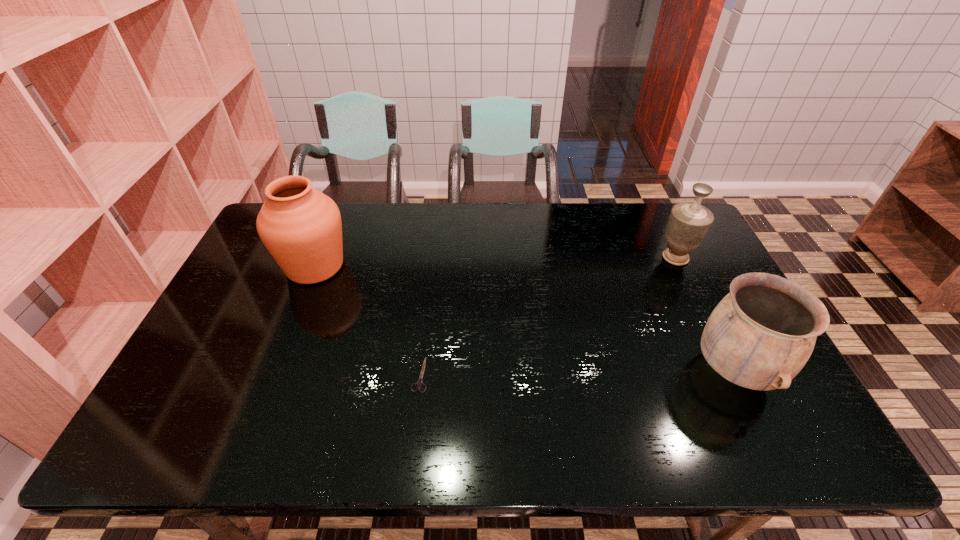
Locate an element on the screen. vacant area at the far edge is located at coordinates (626, 224).

In the image, there is a desktop. Where is `vacant space at the near edge`? This screenshot has height=540, width=960. vacant space at the near edge is located at coordinates (523, 421).

Locate an element on the screen. The height and width of the screenshot is (540, 960). free space at the left edge of the desktop is located at coordinates (235, 286).

The image size is (960, 540). I want to click on vacant space at the right edge of the desktop, so click(693, 290).

This screenshot has height=540, width=960. In the image, there is a desktop. What are the coordinates of `vacant area at the near left corner` in the screenshot? It's located at (200, 454).

You are a GUI agent. You are given a task and a screenshot of the screen. Output one action in this format:
    pyautogui.click(x=<x>, y=<y>)
    Task: Click on the vacant space at the far right corner of the desktop
    Image resolution: width=960 pixels, height=540 pixels.
    Given the screenshot: What is the action you would take?
    pyautogui.click(x=657, y=227)

Locate an element on the screen. free space between the nearest urn and the shortest object is located at coordinates (577, 373).

Identify the location of vacant region between the leftmost urn and the nearest urn. The image size is (960, 540). (525, 318).

What are the coordinates of `free space between the leftmost object and the shears` in the screenshot? It's located at click(x=368, y=320).

The width and height of the screenshot is (960, 540). I want to click on free area in between the nearest urn and the shortest object, so click(577, 373).